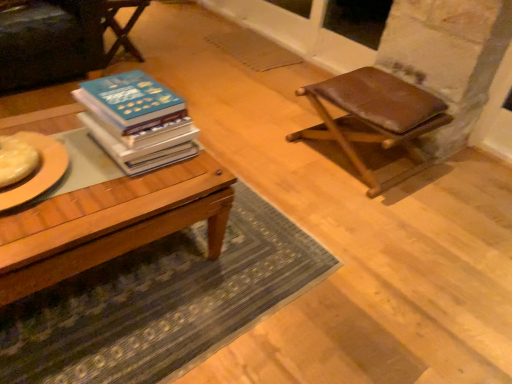
At what (x,y) coordinates should I click in order to perform the action: click on vacant space to the right of green textured rug at lower center. Please return your answer as a coordinate pair (x, y). This screenshot has height=384, width=512. Looking at the image, I should click on (381, 255).